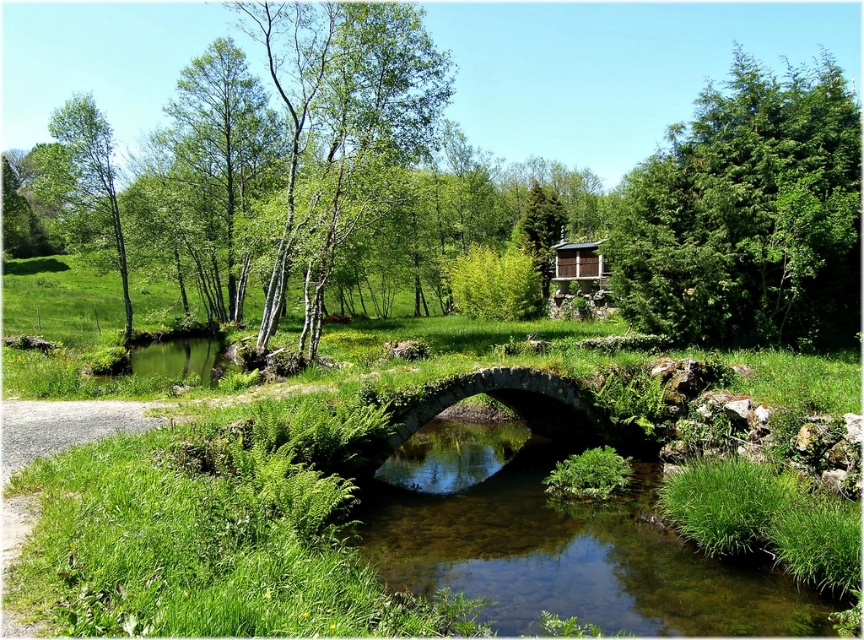
Question: Can you confirm if stone arch bridge at center is thinner than wooden cabin at upper center?

Choices:
 (A) yes
 (B) no

Answer: (A)

Question: Which point is farther from the camera taking this photo?

Choices:
 (A) (553, 248)
 (B) (110, 218)
 (C) (767, 330)

Answer: (A)

Question: Which of the following is the farthest from the observer?

Choices:
 (A) green leafy tree at left
 (B) stone arch bridge at center
 (C) green leafy tree at upper right

Answer: (A)

Question: Can you confirm if stone arch bridge at center is positioned to the left of green leafy tree at left?

Choices:
 (A) no
 (B) yes

Answer: (A)

Question: Which object appears closest to the camera in this image?

Choices:
 (A) green leafy tree at left
 (B) stone arch bridge at center
 (C) green leafy tree at upper right

Answer: (B)

Question: Can you confirm if green leafy tree at upper right is bigger than wooden cabin at upper center?

Choices:
 (A) no
 (B) yes

Answer: (B)